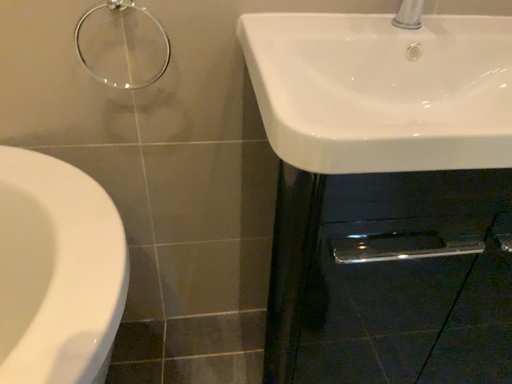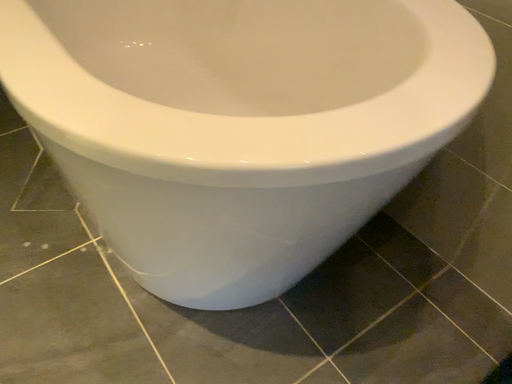
Question: Which way did the camera rotate in the video?

Choices:
 (A) rotated right
 (B) rotated left

Answer: (B)